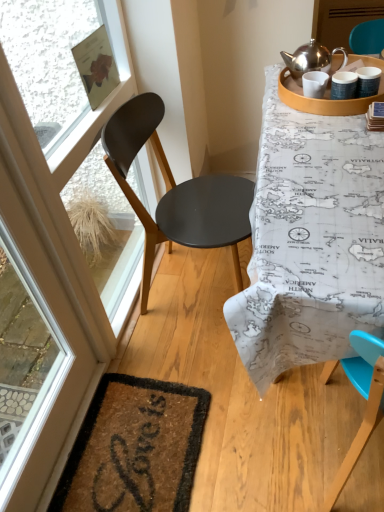
Describe the element at coordinates (342, 19) in the screenshot. I see `matte brown screen door at upper right, which is counted as the 1th screen door, starting from the back` at that location.

You are a GUI agent. You are given a task and a screenshot of the screen. Output one action in this format:
    pyautogui.click(x=<x>, y=<y>)
    Task: Click on the matte black chair at left
    Image resolution: width=384 pixels, height=512 pixels.
    Given the screenshot: What is the action you would take?
    pyautogui.click(x=176, y=191)

You are a GUI agent. You are given a task and a screenshot of the screen. Output one action in this format:
    pyautogui.click(x=<x>, y=<y>)
    Task: Click on the transparent glass screen door at left, positioned as the 1th screen door in left-to-right order
    The image size is (384, 512).
    Given the screenshot: What is the action you would take?
    pyautogui.click(x=56, y=239)

Measure the distance between brown coir mat at lower left and camera.

A distance of 4.13 feet exists between brown coir mat at lower left and camera.

Locate an element on the screen. This screenshot has width=384, height=512. map-patterned tablecloth at upper right is located at coordinates (310, 241).

You are a GUI agent. You are given a task and a screenshot of the screen. Output one action in this format:
    pyautogui.click(x=<x>, y=<y>)
    Task: Click on the transparent glass window screen at upper left
    Image resolution: width=384 pixels, height=512 pixels.
    Given the screenshot: What is the action you would take?
    pyautogui.click(x=69, y=139)

From the picture: Between matte black chair at left and matte brown screen door at upper right, acting as the second screen door starting from the front, which one appears on the right side from the viewer's perspective?

matte brown screen door at upper right, acting as the second screen door starting from the front.

Can you confirm if matte black chair at left is thinner than matte brown screen door at upper right, positioned as the 1th screen door in right-to-left order?

No.

Does matte black chair at left have a lesser height compared to matte brown screen door at upper right, acting as the second screen door starting from the front?

Incorrect, the height of matte black chair at left does not fall short of that of matte brown screen door at upper right, acting as the second screen door starting from the front.

How many degrees apart are the facing directions of brown coir mat at lower left and matte black chair at left?

There is a 1.33-degree angle between the facing directions of brown coir mat at lower left and matte black chair at left.

Can you confirm if brown coir mat at lower left is shorter than matte black chair at left?

Correct, brown coir mat at lower left is not as tall as matte black chair at left.

Would you say brown coir mat at lower left is outside matte black chair at left?

Yes, brown coir mat at lower left is not within matte black chair at left.

Based on the photo, does brown coir mat at lower left have a larger size compared to matte black chair at left?

No.

From the image's perspective, which is above, brown coir mat at lower left or transparent glass screen door at left, acting as the 2th screen door starting from the top?

transparent glass screen door at left, acting as the 2th screen door starting from the top, from the image's perspective.

Is brown coir mat at lower left positioned beyond the bounds of transparent glass screen door at left, the first screen door from the front?

Indeed, brown coir mat at lower left is completely outside transparent glass screen door at left, the first screen door from the front.

Is brown coir mat at lower left taller or shorter than transparent glass screen door at left, the second screen door positioned from the back?

Clearly, brown coir mat at lower left is shorter compared to transparent glass screen door at left, the second screen door positioned from the back.

In the image, is brown coir mat at lower left on the left side or the right side of transparent glass screen door at left, which is the first screen door in bottom-to-top order?

brown coir mat at lower left is positioned on transparent glass screen door at left, which is the first screen door in bottom-to-top order,'s right side.

Can you confirm if matte wooden tray at upper right is positioned to the right of transparent glass window screen at upper left?

Yes.

From a real-world perspective, is matte wooden tray at upper right located higher than transparent glass window screen at upper left?

Yes.

Locate an element on the screen. This screenshot has height=512, width=384. round table located above the transparent glass window screen at upper left (from the image's perspective) is located at coordinates (328, 94).

Is point (383, 97) positioned before point (84, 122)?

Yes, it is.

Image resolution: width=384 pixels, height=512 pixels. What are the coordinates of `chair lying below the matte wooden tray at upper right (from the image's perspective)` in the screenshot? It's located at (176, 191).

Is matte wooden tray at upper right completely or partially outside of matte black chair at left?

Yes, matte wooden tray at upper right is outside of matte black chair at left.

Considering the sizes of objects matte wooden tray at upper right and map-patterned tablecloth at upper right in the image provided, who is thinner, matte wooden tray at upper right or map-patterned tablecloth at upper right?

Thinner between the two is matte wooden tray at upper right.

From the image's perspective, does matte wooden tray at upper right appear lower than map-patterned tablecloth at upper right?

Incorrect, from the image's perspective, matte wooden tray at upper right is higher than map-patterned tablecloth at upper right.

Considering the positions of point (337, 56) and point (295, 349), is point (337, 56) closer or farther from the camera than point (295, 349)?

Point (337, 56) appears to be farther away from the viewer than point (295, 349).

Is matte wooden tray at upper right positioned in front of map-patterned tablecloth at upper right?

No, matte wooden tray at upper right is behind map-patterned tablecloth at upper right.

Consider the image. From the image's perspective, is transparent glass window screen at upper left over brown coir mat at lower left?

Yes, from the image's perspective, transparent glass window screen at upper left is over brown coir mat at lower left.

Where is `window screen in front of the brown coir mat at lower left`? This screenshot has width=384, height=512. window screen in front of the brown coir mat at lower left is located at coordinates (69, 139).

How different are the orientations of transparent glass window screen at upper left and brown coir mat at lower left in degrees?

The angle between the facing direction of transparent glass window screen at upper left and the facing direction of brown coir mat at lower left is 0.829 degrees.

Considering the points (88, 121) and (200, 410), which point is behind, point (88, 121) or point (200, 410)?

The point (200, 410) is behind.

Identify the location of chair that is in front of the matte brown screen door at upper right, placed as the second screen door when sorted from bottom to top. This screenshot has height=512, width=384. (176, 191).

The image size is (384, 512). Find the location of `mat on the left of matte black chair at left`. mat on the left of matte black chair at left is located at coordinates (135, 448).

Which object lies further to the anchor point map-patterned tablecloth at upper right, matte wooden tray at upper right or transparent glass window screen at upper left?

transparent glass window screen at upper left is further to map-patterned tablecloth at upper right.

From the image, which object appears to be nearer to transparent glass screen door at left, the first screen door from the front, matte black chair at left or matte brown screen door at upper right, which appears as the second screen door when viewed from the left?

Based on the image, matte black chair at left appears to be nearer to transparent glass screen door at left, the first screen door from the front.

Which object lies nearer to the anchor point transparent glass screen door at left, the second screen door positioned from the back, matte wooden tray at upper right or matte brown screen door at upper right, placed as the first screen door when sorted from top to bottom?

matte wooden tray at upper right is positioned closer to the anchor transparent glass screen door at left, the second screen door positioned from the back.

Based on their spatial positions, is brown coir mat at lower left or map-patterned tablecloth at upper right closer to matte brown screen door at upper right, which appears as the second screen door when viewed from the left?

The object closer to matte brown screen door at upper right, which appears as the second screen door when viewed from the left, is map-patterned tablecloth at upper right.

Considering their positions, is transparent glass window screen at upper left positioned further to matte wooden tray at upper right than matte black chair at left?

transparent glass window screen at upper left is positioned further to the anchor matte wooden tray at upper right.

Looking at the image, which one is located closer to brown coir mat at lower left, transparent glass window screen at upper left or map-patterned tablecloth at upper right?

Based on the image, map-patterned tablecloth at upper right appears to be nearer to brown coir mat at lower left.

From the image, which object appears to be farther from transparent glass screen door at left, the first screen door from the front, transparent glass window screen at upper left or brown coir mat at lower left?

Based on the image, brown coir mat at lower left appears to be further to transparent glass screen door at left, the first screen door from the front.

Which object lies further to the anchor point matte brown screen door at upper right, acting as the second screen door starting from the front, matte black chair at left or transparent glass window screen at upper left?

The object further to matte brown screen door at upper right, acting as the second screen door starting from the front, is transparent glass window screen at upper left.

Find the location of a particular element. The image size is (384, 512). table between transparent glass window screen at upper left and brown coir mat at lower left vertically is located at coordinates (310, 241).

Image resolution: width=384 pixels, height=512 pixels. In order to click on chair positioned between transparent glass screen door at left, which is the first screen door in bottom-to-top order, and transparent glass window screen at upper left from near to far in this screenshot , I will do (176, 191).

Identify the location of table between transparent glass screen door at left, the second screen door positioned from the back, and matte brown screen door at upper right, positioned as the 1th screen door in right-to-left order, in the front-back direction. Image resolution: width=384 pixels, height=512 pixels. (310, 241).

I want to click on mat between transparent glass screen door at left, which is the first screen door in bottom-to-top order, and matte brown screen door at upper right, which is counted as the 1th screen door, starting from the back, along the z-axis, so click(135, 448).